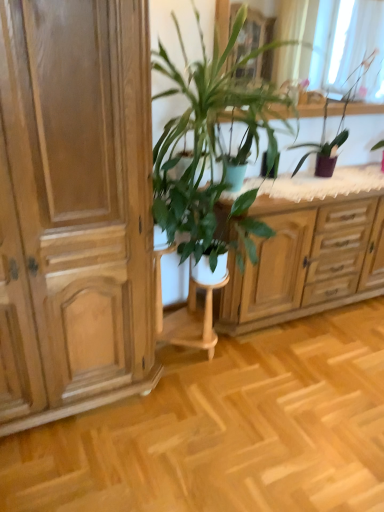
Question: Which direction should I rotate to look at green leafy plant at center, which is the first houseplant in left-to-right order?

Choices:
 (A) left
 (B) right

Answer: (B)

Question: Is light brown wood cabinet at left located within purple glossy vase at upper right, which ranks as the second houseplant in left-to-right order?

Choices:
 (A) yes
 (B) no

Answer: (B)

Question: Is purple glossy vase at upper right, which is the first houseplant from right to left, behind light brown wood cabinet at left?

Choices:
 (A) yes
 (B) no

Answer: (A)

Question: Can you confirm if purple glossy vase at upper right, which ranks as the second houseplant in left-to-right order, is bigger than light brown wood cabinet at left?

Choices:
 (A) no
 (B) yes

Answer: (A)

Question: From the image's perspective, would you say purple glossy vase at upper right, which ranks as the second houseplant in left-to-right order, is shown under light brown wood cabinet at left?

Choices:
 (A) no
 (B) yes

Answer: (A)

Question: Is purple glossy vase at upper right, which ranks as the second houseplant in left-to-right order, positioned beyond the bounds of light brown wood cabinet at left?

Choices:
 (A) yes
 (B) no

Answer: (A)

Question: Considering the relative positions of purple glossy vase at upper right, which ranks as the second houseplant in left-to-right order, and light brown wood cabinet at left in the image provided, is purple glossy vase at upper right, which ranks as the second houseplant in left-to-right order, to the left of light brown wood cabinet at left from the viewer's perspective?

Choices:
 (A) no
 (B) yes

Answer: (A)

Question: Considering the relative sizes of purple glossy vase at upper right, which ranks as the second houseplant in left-to-right order, and translucent fabric at upper center in the image provided, is purple glossy vase at upper right, which ranks as the second houseplant in left-to-right order, wider than translucent fabric at upper center?

Choices:
 (A) no
 (B) yes

Answer: (B)

Question: Is purple glossy vase at upper right, which is the first houseplant from right to left, shorter than translucent fabric at upper center?

Choices:
 (A) yes
 (B) no

Answer: (A)

Question: From the image's perspective, is purple glossy vase at upper right, which is the first houseplant from right to left, over translucent fabric at upper center?

Choices:
 (A) no
 (B) yes

Answer: (A)

Question: Is purple glossy vase at upper right, which ranks as the second houseplant in left-to-right order, outside of translucent fabric at upper center?

Choices:
 (A) yes
 (B) no

Answer: (A)

Question: Considering the relative sizes of purple glossy vase at upper right, which ranks as the second houseplant in left-to-right order, and translucent fabric at upper center in the image provided, is purple glossy vase at upper right, which ranks as the second houseplant in left-to-right order, smaller than translucent fabric at upper center?

Choices:
 (A) yes
 (B) no

Answer: (B)

Question: Considering the relative sizes of purple glossy vase at upper right, which is the first houseplant from right to left, and translucent fabric at upper center in the image provided, is purple glossy vase at upper right, which is the first houseplant from right to left, bigger than translucent fabric at upper center?

Choices:
 (A) no
 (B) yes

Answer: (B)

Question: Is the depth of light brown wood cabinet at left greater than that of green matte flowerpot at center?

Choices:
 (A) no
 (B) yes

Answer: (A)